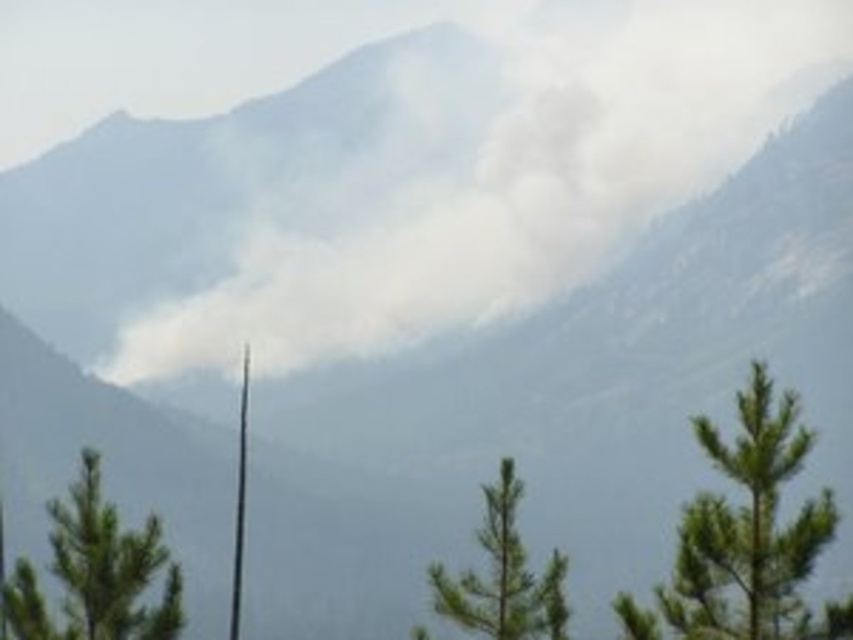
Question: Can you confirm if white smoke at center is wider than green needle-like tree at center?

Choices:
 (A) no
 (B) yes

Answer: (B)

Question: Which of the following is the farthest from the observer?

Choices:
 (A) white smoke at center
 (B) green needle-like tree at center-right
 (C) green needle-like tree at center

Answer: (A)

Question: Which of these objects is positioned closest to the green needle-like tree at center-right?

Choices:
 (A) green matte tree at lower left
 (B) green needle-like tree at center
 (C) white smoke at center

Answer: (B)

Question: Where is white smoke at center located in relation to green matte tree at lower left in the image?

Choices:
 (A) left
 (B) right

Answer: (B)

Question: Which point is closer to the camera taking this photo?

Choices:
 (A) (747, 564)
 (B) (460, 241)
 (C) (107, 531)

Answer: (A)

Question: Does green needle-like tree at center-right have a larger size compared to green matte tree at lower left?

Choices:
 (A) yes
 (B) no

Answer: (A)